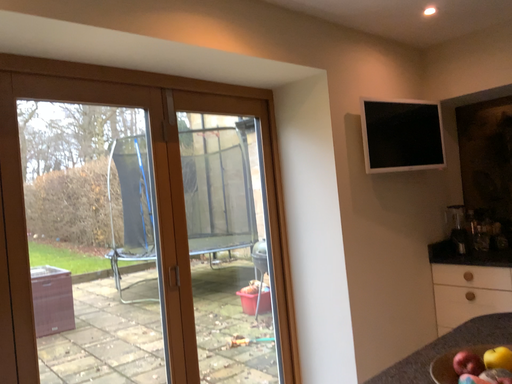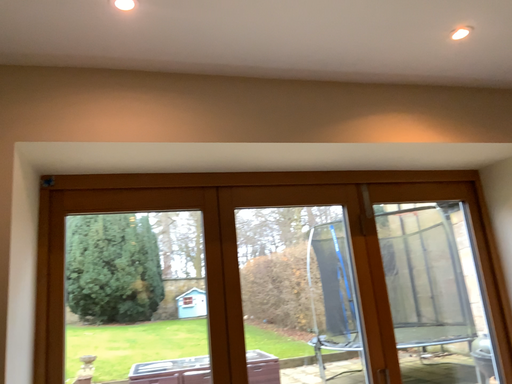
Question: How did the camera likely rotate when shooting the video?

Choices:
 (A) rotated right
 (B) rotated left

Answer: (B)